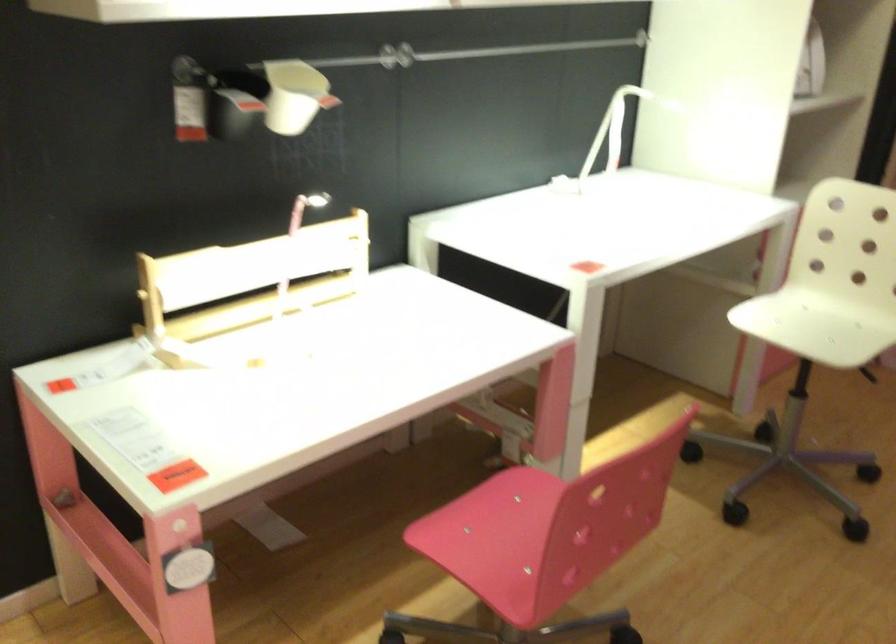
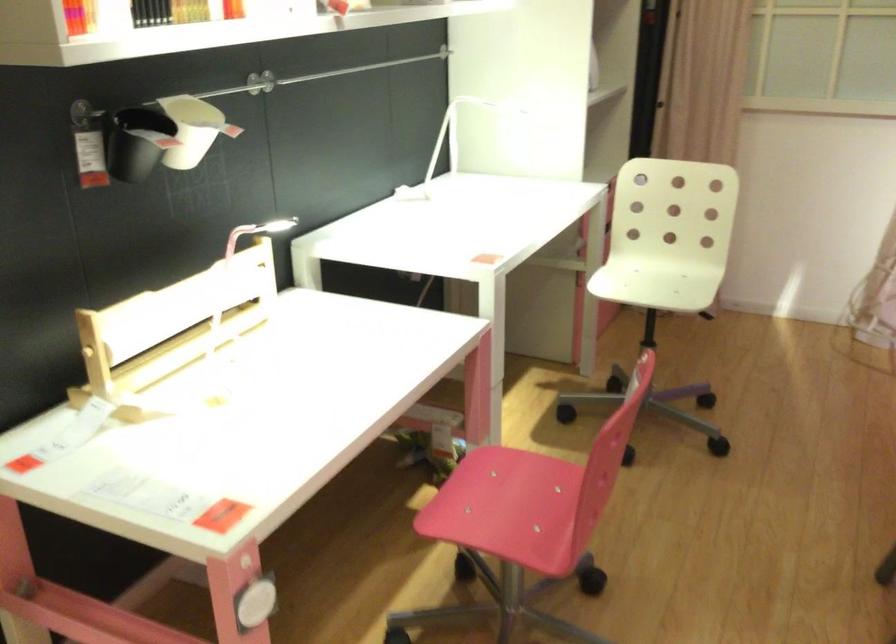
The point at (x=530, y=512) is marked in the first image. Where is the corresponding point in the second image?

(511, 482)